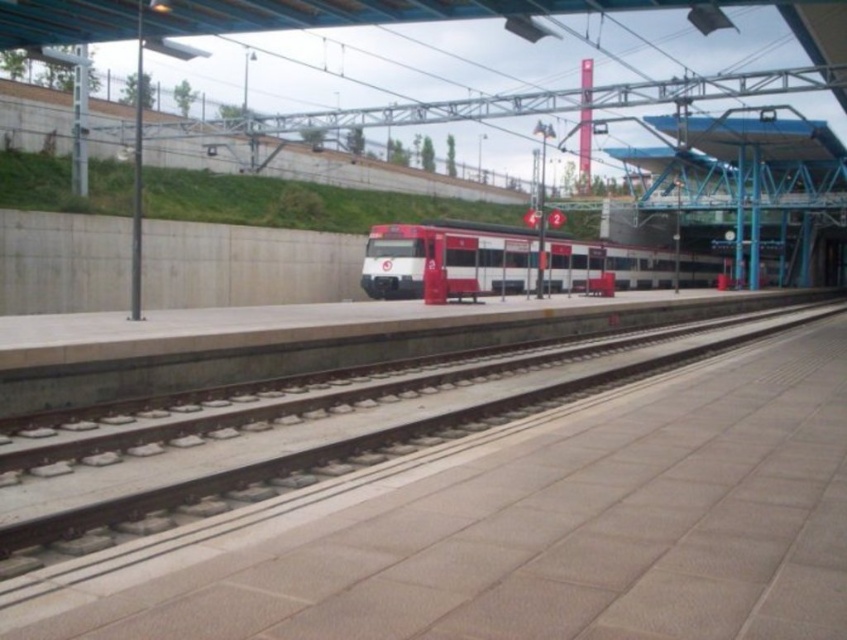
Question: Which point is closer to the camera taking this photo?

Choices:
 (A) (549, 275)
 (B) (329, 467)

Answer: (B)

Question: Where is smooth concrete track at center located in relation to white glossy train at center in the image?

Choices:
 (A) right
 (B) left

Answer: (B)

Question: In this image, where is smooth concrete track at center located relative to white glossy train at center?

Choices:
 (A) above
 (B) below

Answer: (B)

Question: Which point appears farthest from the camera in this image?

Choices:
 (A) (412, 273)
 (B) (274, 467)

Answer: (A)

Question: Among these points, which one is farthest from the camera?

Choices:
 (A) (93, 545)
 (B) (418, 243)

Answer: (B)

Question: In this image, where is smooth concrete track at center located relative to white glossy train at center?

Choices:
 (A) left
 (B) right

Answer: (A)